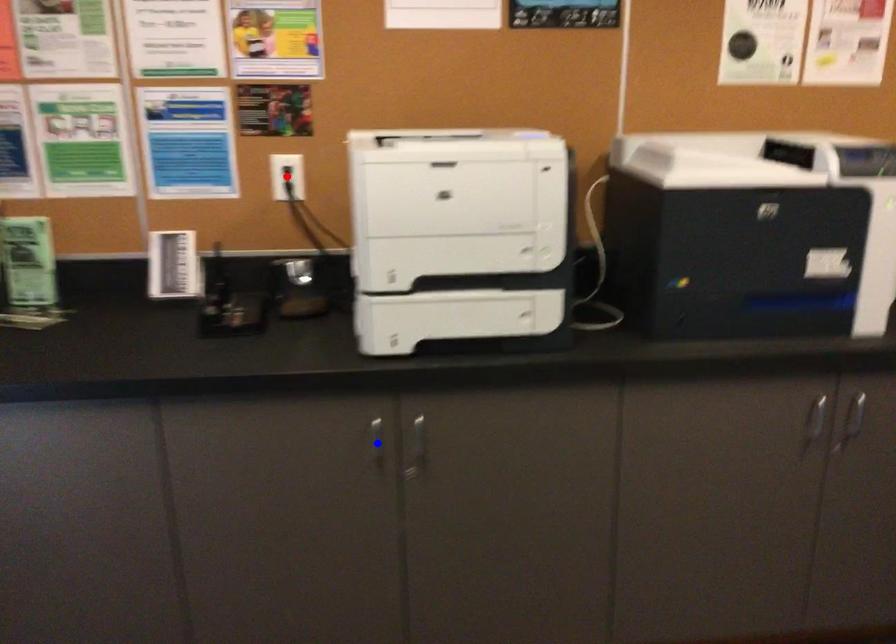
Question: In the image, two points are highlighted. Which point is nearer to the camera? Reply with the corresponding letter.

Choices:
 (A) blue point
 (B) red point

Answer: (A)